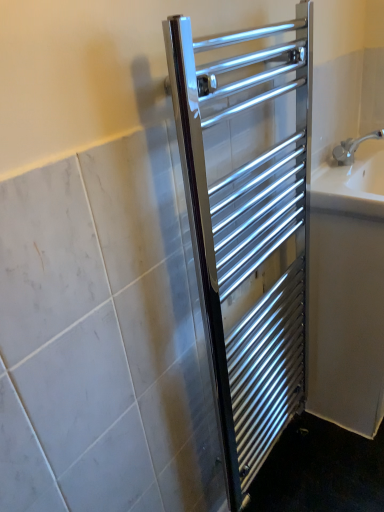
Question: Is white ceramic sink at right shorter than white glossy bath at right?

Choices:
 (A) yes
 (B) no

Answer: (A)

Question: Can you confirm if white ceramic sink at right is bigger than white glossy bath at right?

Choices:
 (A) yes
 (B) no

Answer: (B)

Question: Considering the relative positions of white ceramic sink at right and white glossy bath at right in the image provided, is white ceramic sink at right behind white glossy bath at right?

Choices:
 (A) yes
 (B) no

Answer: (B)

Question: Considering the relative positions of white ceramic sink at right and white glossy bath at right in the image provided, is white ceramic sink at right to the left of white glossy bath at right from the viewer's perspective?

Choices:
 (A) no
 (B) yes

Answer: (B)

Question: From a real-world perspective, is white ceramic sink at right on white glossy bath at right?

Choices:
 (A) yes
 (B) no

Answer: (A)

Question: Based on their positions, is polished chrome towel rack at center located to the left or right of white ceramic sink at right?

Choices:
 (A) right
 (B) left

Answer: (B)

Question: Is polished chrome towel rack at center spatially inside white ceramic sink at right, or outside of it?

Choices:
 (A) inside
 (B) outside

Answer: (B)

Question: From the image's perspective, is polished chrome towel rack at center located above or below white ceramic sink at right?

Choices:
 (A) above
 (B) below

Answer: (B)

Question: Is point (218, 386) closer or farther from the camera than point (329, 178)?

Choices:
 (A) farther
 (B) closer

Answer: (B)

Question: Does point (352, 208) appear closer or farther from the camera than point (296, 75)?

Choices:
 (A) closer
 (B) farther

Answer: (B)

Question: From their relative heights in the image, would you say white ceramic sink at right is taller or shorter than polished chrome towel rack at center?

Choices:
 (A) short
 (B) tall

Answer: (A)

Question: Would you say white ceramic sink at right is inside or outside polished chrome towel rack at center?

Choices:
 (A) outside
 (B) inside

Answer: (A)

Question: Looking at their shapes, would you say white ceramic sink at right is wider or thinner than polished chrome towel rack at center?

Choices:
 (A) wide
 (B) thin

Answer: (A)

Question: Considering the positions of polished chrome towel rack at center and white glossy bath at right in the image, is polished chrome towel rack at center bigger or smaller than white glossy bath at right?

Choices:
 (A) small
 (B) big

Answer: (A)

Question: Is polished chrome towel rack at center wider or thinner than white glossy bath at right?

Choices:
 (A) thin
 (B) wide

Answer: (A)